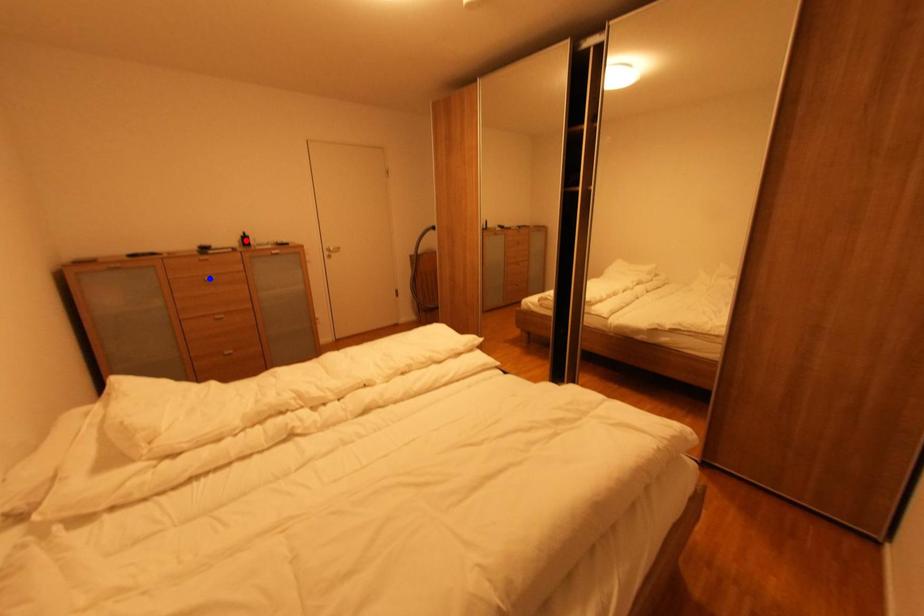
Question: Two points are marked on the image. Which point is closer to the camera?

Choices:
 (A) Blue point is closer.
 (B) Red point is closer.

Answer: (A)